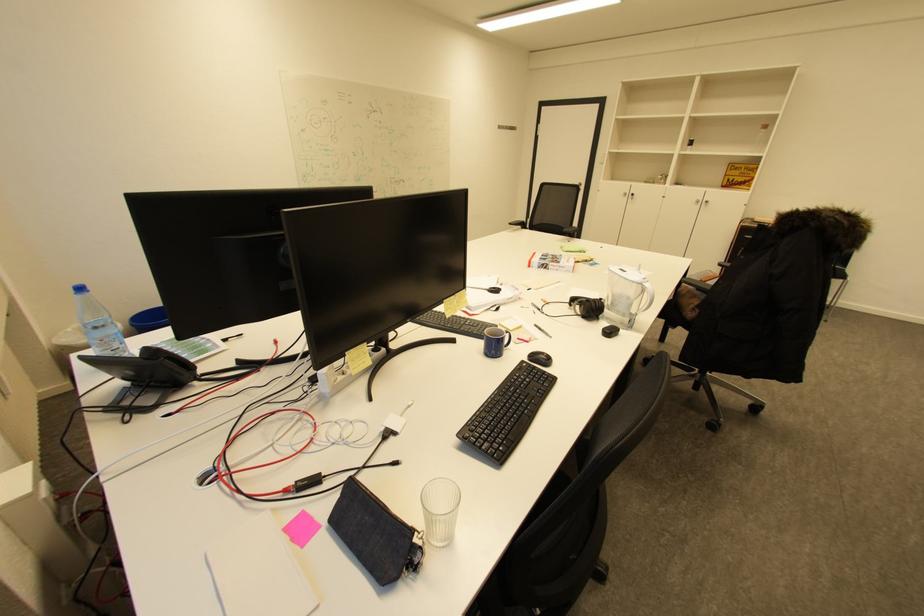
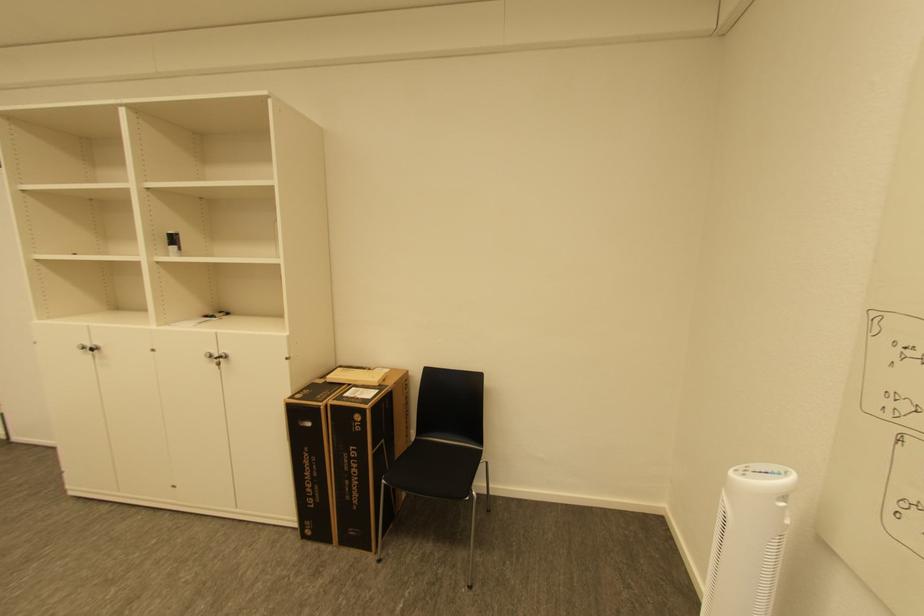
In the second image, find the point that corresponds to (696,147) in the first image.

(176, 245)